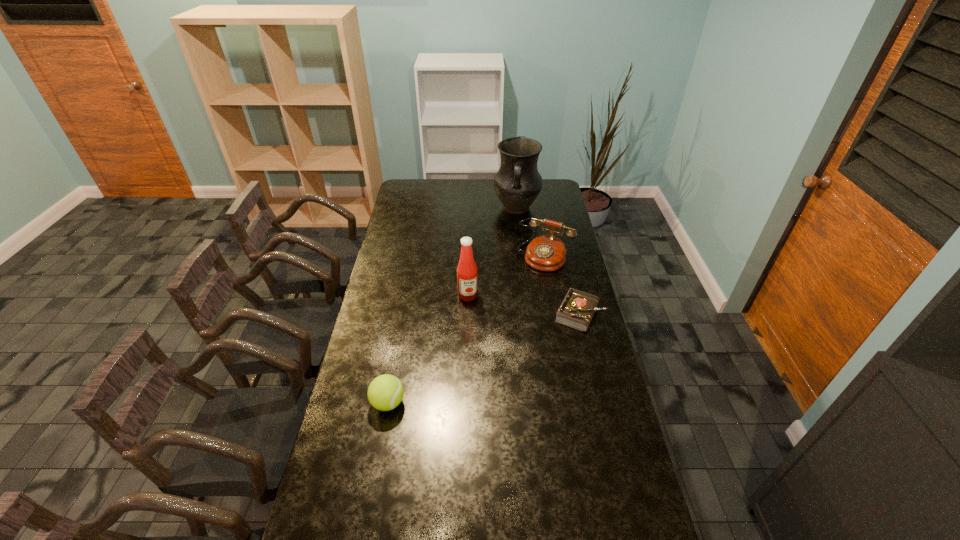
This screenshot has width=960, height=540. What are the coordinates of `tennis ball` in the screenshot? It's located at (385, 392).

Locate an element on the screen. the leftmost object is located at coordinates (385, 392).

Where is `the shortest object`? Image resolution: width=960 pixels, height=540 pixels. the shortest object is located at coordinates (577, 310).

This screenshot has width=960, height=540. I want to click on condiment, so click(467, 277).

The width and height of the screenshot is (960, 540). Find the location of `the fourth shortest object`. the fourth shortest object is located at coordinates (467, 277).

Find the location of a particular element. The width and height of the screenshot is (960, 540). the farthest object is located at coordinates (517, 183).

Find the location of a particular element. Image resolution: width=960 pixels, height=540 pixels. pitcher is located at coordinates (517, 183).

Identify the location of the third shortest object. The width and height of the screenshot is (960, 540). (546, 252).

The height and width of the screenshot is (540, 960). What are the coordinates of `the fourth nearest object` in the screenshot? It's located at (546, 252).

This screenshot has width=960, height=540. What are the coordinates of `vacant area located on the front of the fourth tallest object` in the screenshot? It's located at (365, 531).